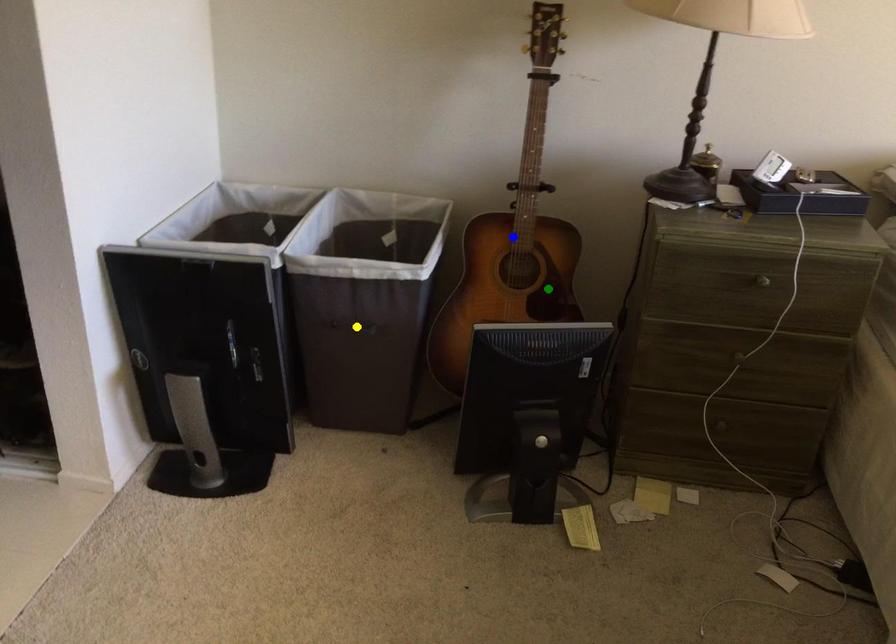
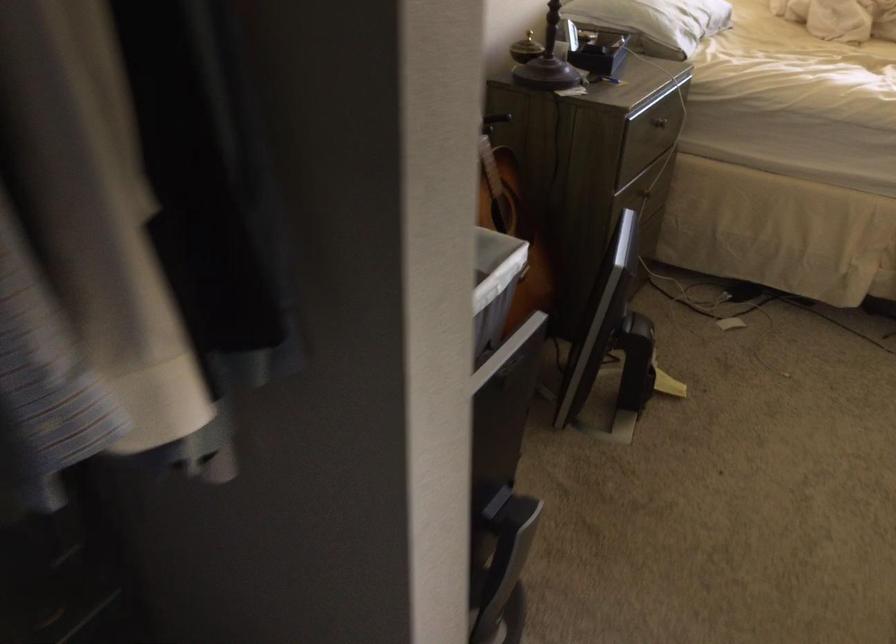
I am providing you with two images of the same scene from different viewpoints. Three points are marked in image1. Which point corresponds to a part or object that is occluded in image2?In image1, three points are marked. Which of them correspond to a part or object that is occluded in image2?Among the three points shown in image1, which one corresponds to a part or object that is no longer visible due to occlusion in image2?

Invisible in image2: yellow point, blue point.